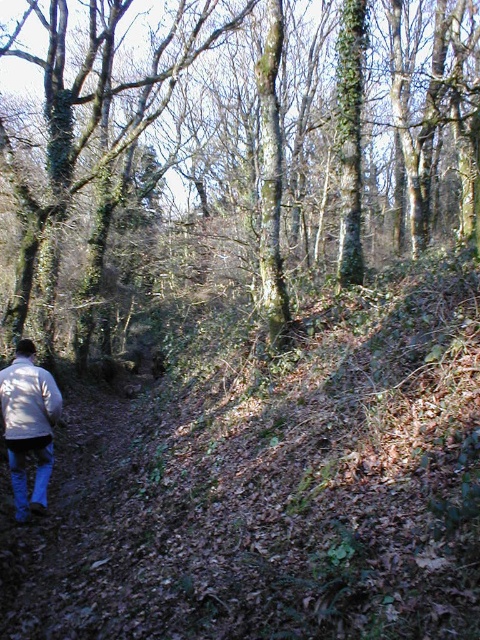
Between green rough bark tree at center and white matte jacket at lower left, which one appears on the right side from the viewer's perspective?

green rough bark tree at center is more to the right.

Who is higher up, green rough bark tree at center or white matte jacket at lower left?

green rough bark tree at center is higher up.

Is point (0, 321) positioned before point (40, 500)?

No, (0, 321) is behind (40, 500).

Identify the location of green rough bark tree at center. (229, 154).